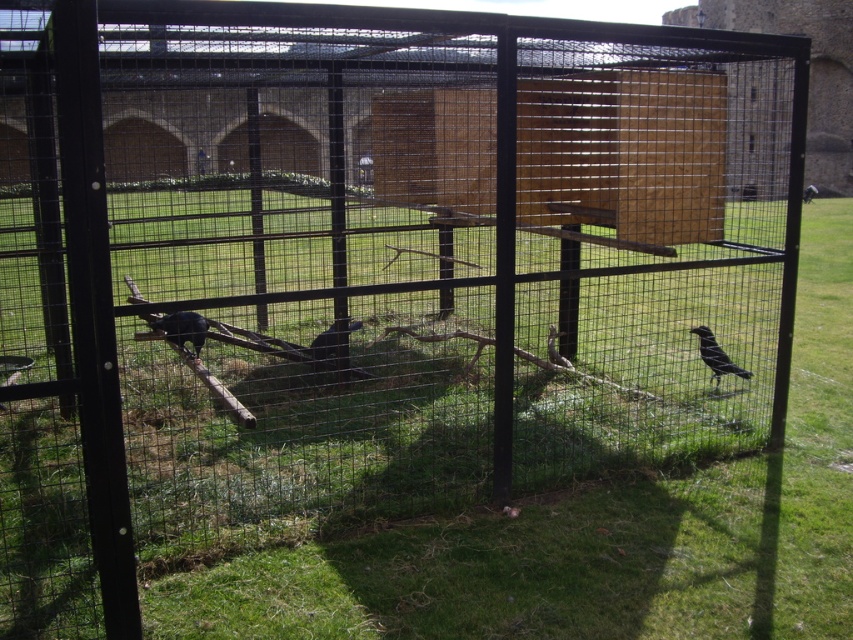
Question: Which object is farther from the camera taking this photo?

Choices:
 (A) shiny black bird at center
 (B) black matte bird at right

Answer: (A)

Question: Does black matte bird at right appear over matte black bird at center?

Choices:
 (A) yes
 (B) no

Answer: (B)

Question: Which of the following is the farthest from the observer?

Choices:
 (A) (325, 333)
 (B) (729, 369)

Answer: (A)

Question: Which point is farther to the camera?

Choices:
 (A) black matte bird at right
 (B) matte black bird at center

Answer: (B)

Question: Can you confirm if black matte bird at right is wider than matte black bird at center?

Choices:
 (A) yes
 (B) no

Answer: (B)

Question: Observing the image, what is the correct spatial positioning of shiny black bird at center in reference to black matte bird at right?

Choices:
 (A) right
 (B) left

Answer: (B)